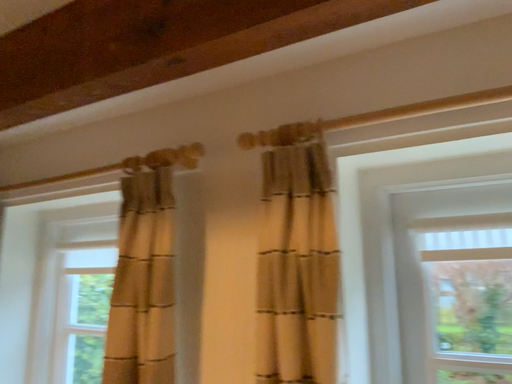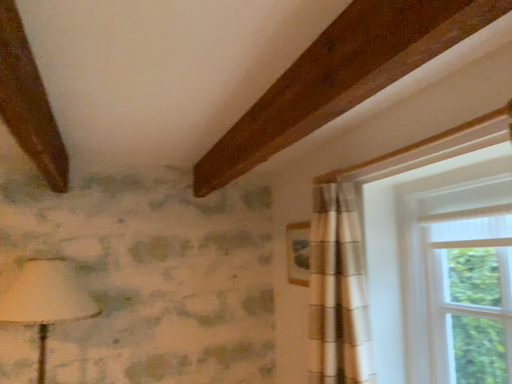
Question: Which way did the camera rotate in the video?

Choices:
 (A) rotated right
 (B) rotated left

Answer: (B)